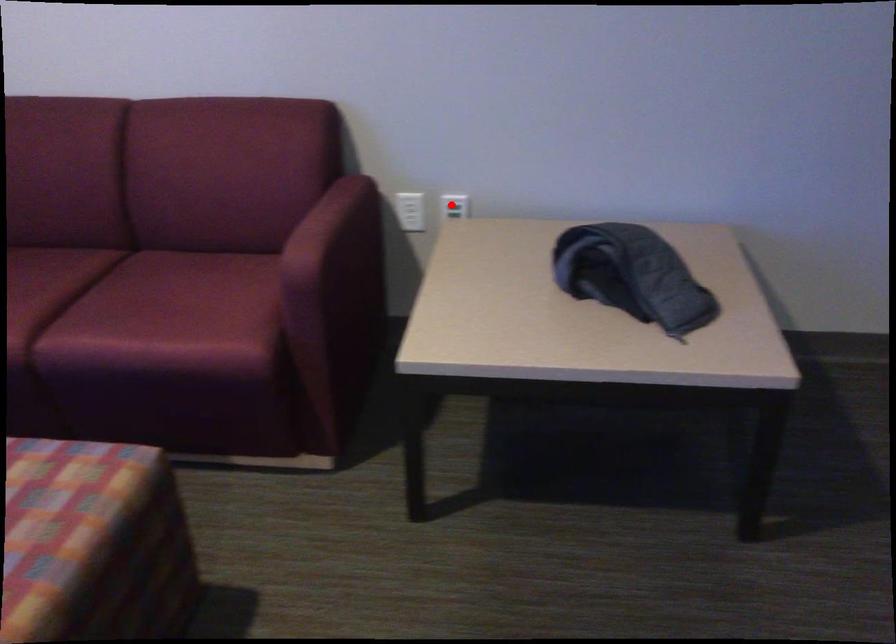
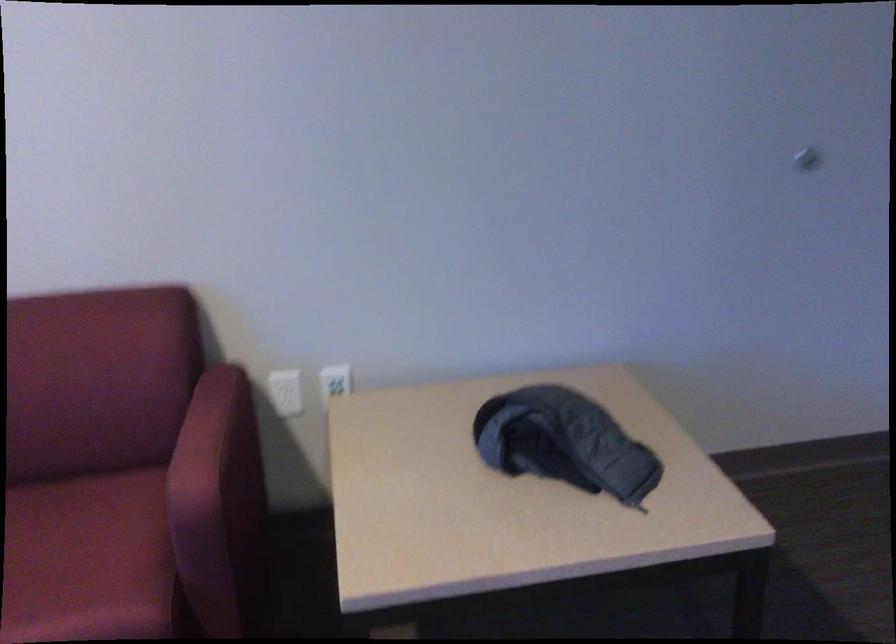
Find the pixel in the second image that matches the highlighted location in the first image.

(334, 382)